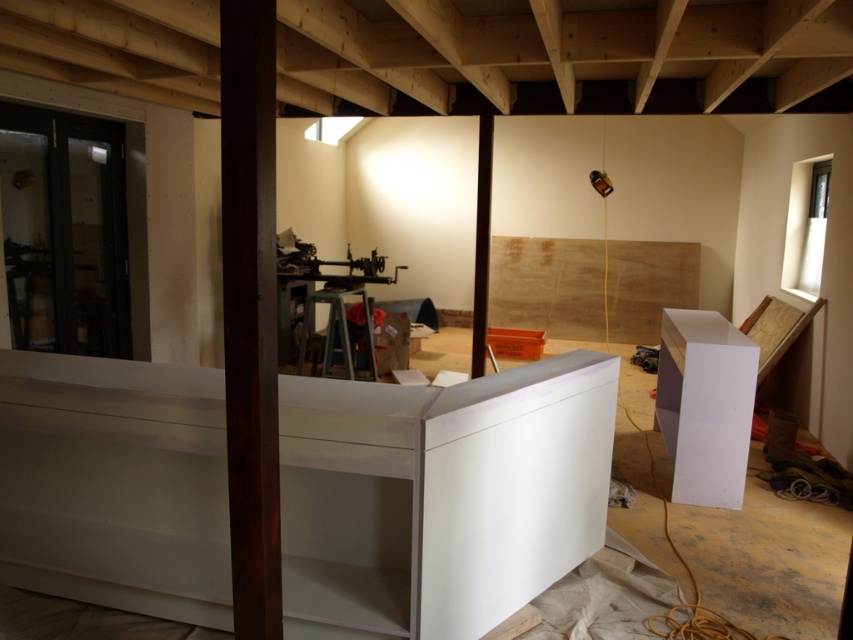
You are an interior designer planning to move a large potted plant into the room. The plant requires a spot that is to the left of the matte black beam at center and also to the right of the white glossy cabinet at right. Is this possible?

The white glossy cabinet at right is positioned on the right side of the matte black beam at center, so there is no space to the left of the matte black beam at center and to the right of the white glossy cabinet at right. Therefore, it is not possible to place the plant in that location.

You are standing in the room and want to place a new plant pot exactly at the center of the room. The dark wood pillar at center is located at point [250,312]. Can you place the plant pot there?

The dark wood pillar at center is located at point [250,312], so you cannot place the plant pot there because the pillar is already occupying that location.